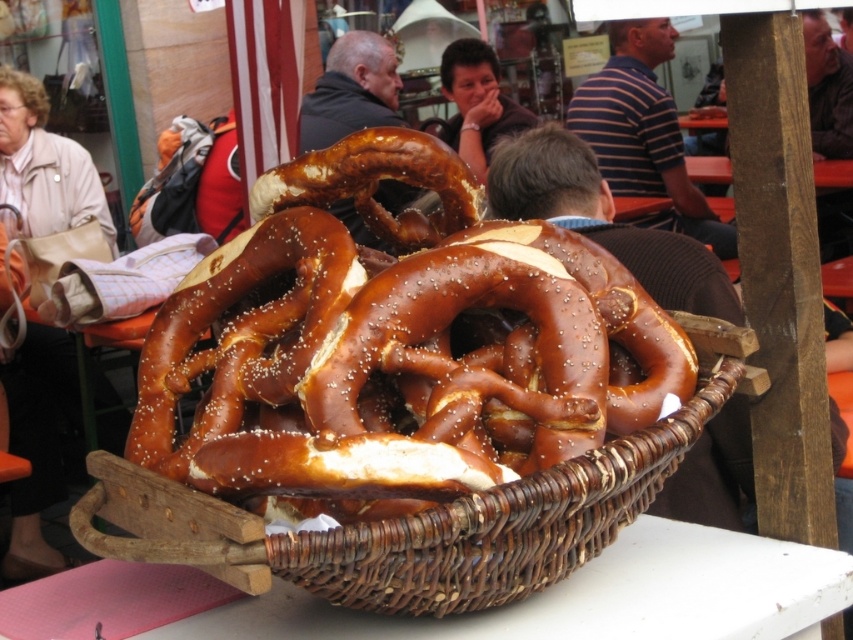
Question: Is golden brown pretzel at center closer to camera compared to smooth brown hair at upper center?

Choices:
 (A) yes
 (B) no

Answer: (A)

Question: Which point is farther to the camera?

Choices:
 (A) (467, 124)
 (B) (614, 419)

Answer: (A)

Question: Among these objects, which one is nearest to the camera?

Choices:
 (A) striped cotton shirt at upper center
 (B) wooden table at center

Answer: (A)

Question: Can you confirm if beige leather handbag at left is positioned below smooth brown hair at upper center?

Choices:
 (A) no
 (B) yes

Answer: (B)

Question: Which of these objects is positioned farthest from the beige leather handbag at left?

Choices:
 (A) wooden table at center
 (B) golden brown pretzel at center

Answer: (B)

Question: Is striped cotton shirt at upper center wider than smooth brown hair at upper center?

Choices:
 (A) yes
 (B) no

Answer: (A)